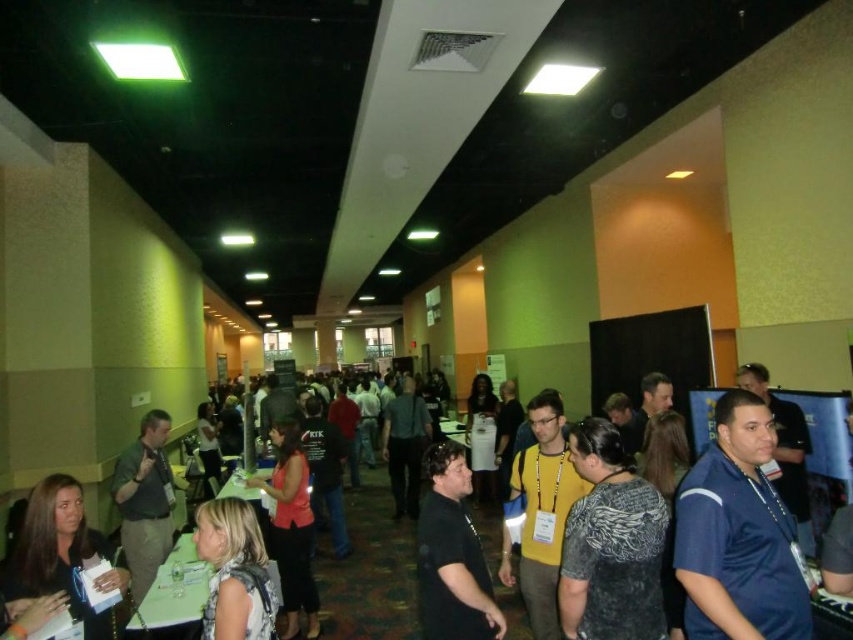
Is blue jersey at center below black matte shirt at center?

No, blue jersey at center is not below black matte shirt at center.

Who is positioned more to the left, blue jersey at center or black matte shirt at center?

Positioned to the left is black matte shirt at center.

The height and width of the screenshot is (640, 853). Find the location of `blue jersey at center`. blue jersey at center is located at coordinates (738, 536).

Image resolution: width=853 pixels, height=640 pixels. In order to click on blue jersey at center in this screenshot , I will do `click(738, 536)`.